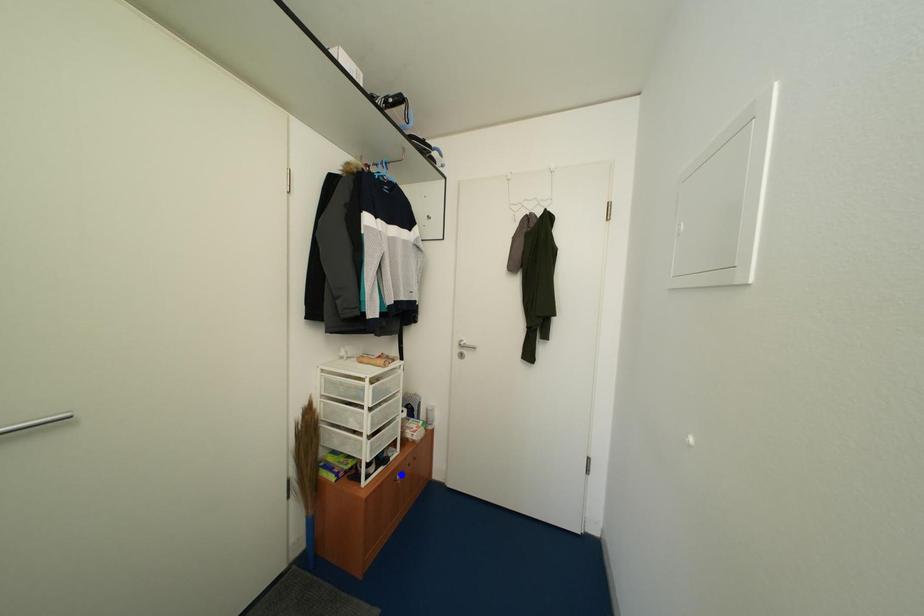
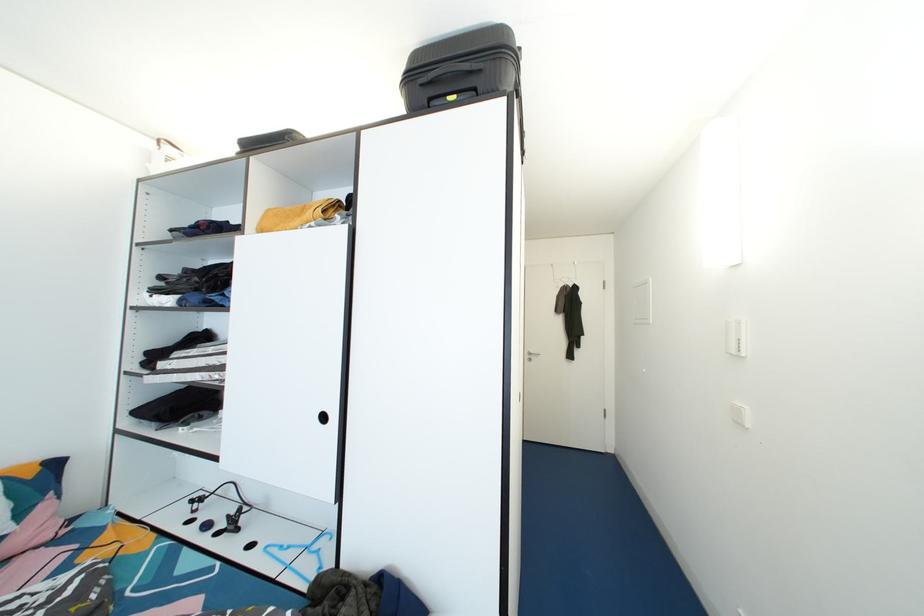
I am providing you with two images of the same scene from different viewpoints. Three points are marked in image1. Which point corresponds to a part or object that is occluded in image2?In image1, three points are marked. Which of them correspond to a part or object that is occluded in image2?Among the three points shown in image1, which one corresponds to a part or object that is no longer visible due to occlusion in image2?

Invisible in image2: yellow point, green point, blue point.